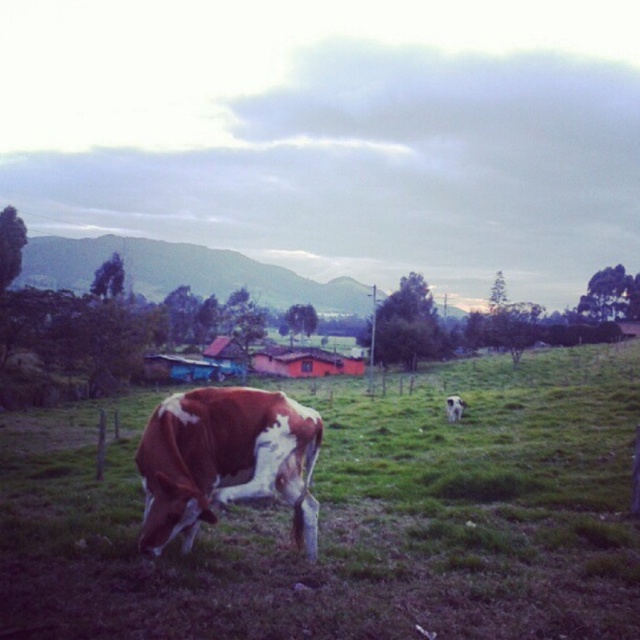
Question: Observing the image, what is the correct spatial positioning of brown speckled cow at lower left in reference to white fur at center?

Choices:
 (A) right
 (B) left

Answer: (B)

Question: Does brown speckled cow at lower left have a greater width compared to brown speckled cow at center?

Choices:
 (A) yes
 (B) no

Answer: (A)

Question: Based on their relative distances, which object is nearer to the white fur at center?

Choices:
 (A) brown speckled cow at center
 (B) brown speckled cow at lower left

Answer: (B)

Question: Is brown speckled cow at lower left below brown speckled cow at center?

Choices:
 (A) no
 (B) yes

Answer: (B)

Question: Which of the following is the closest to the observer?

Choices:
 (A) brown speckled cow at lower left
 (B) brown speckled cow at center
 (C) white fur at center

Answer: (A)

Question: Which is farther from the brown speckled cow at center?

Choices:
 (A) white fur at center
 (B) brown speckled cow at lower left

Answer: (B)